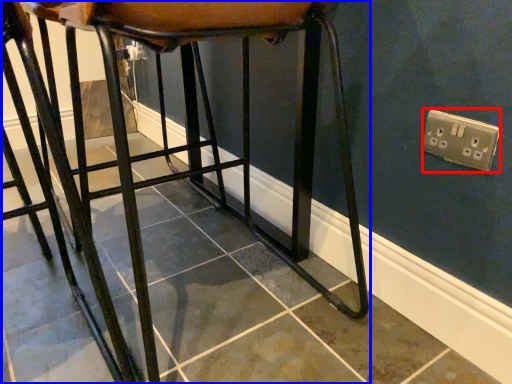
Question: Which point is closer to the camera, electric outlet (highlighted by a red box) or furniture (highlighted by a blue box)?

Choices:
 (A) electric outlet
 (B) furniture

Answer: (B)